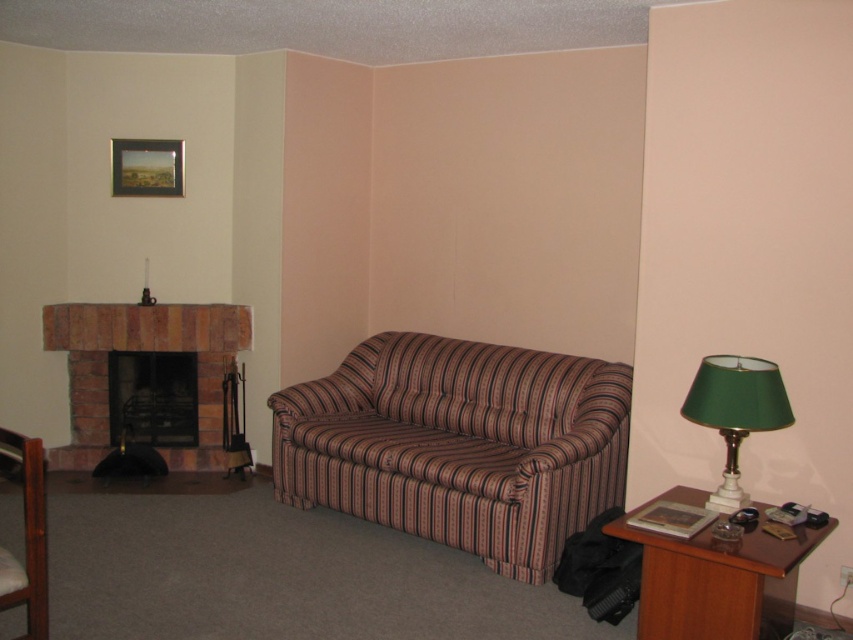
Question: Which point is farther from the camera taking this photo?

Choices:
 (A) (457, 490)
 (B) (144, 179)
 (C) (45, 611)

Answer: (B)

Question: Is rustic stone fireplace at left bigger than wooden picture frame at upper left?

Choices:
 (A) no
 (B) yes

Answer: (B)

Question: Does striped fabric couch at center have a lesser width compared to rustic stone fireplace at left?

Choices:
 (A) yes
 (B) no

Answer: (B)

Question: Estimate the real-world distances between objects in this image. Which object is farther from the striped fabric couch at center?

Choices:
 (A) green fabric lampshade at right
 (B) wooden picture frame at upper left

Answer: (B)

Question: Which point is farther to the camera?

Choices:
 (A) (747, 586)
 (B) (167, 140)
 (C) (555, 417)

Answer: (B)

Question: Is striped fabric couch at center thinner than green fabric lampshade at right?

Choices:
 (A) no
 (B) yes

Answer: (A)